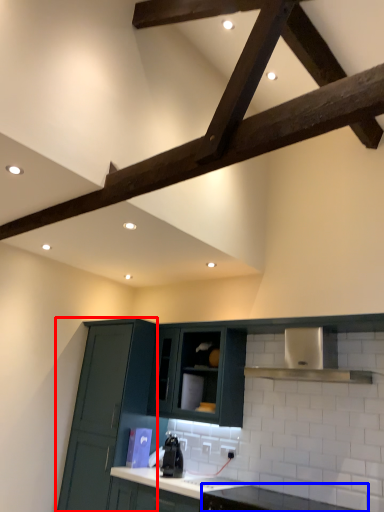
Question: Which object appears closest to the camera in this image, cabinetry (highlighted by a red box) or countertop (highlighted by a blue box)?

Choices:
 (A) cabinetry
 (B) countertop

Answer: (B)